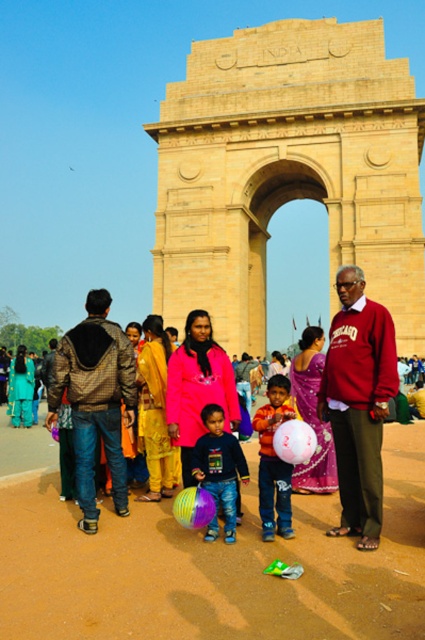
Question: Can you confirm if brown textured jacket at center is smaller than matte pink dress at center?

Choices:
 (A) no
 (B) yes

Answer: (B)

Question: Which object is the farthest from the multicolored plastic ball at center?

Choices:
 (A) brown textured jacket at center
 (B) translucent multicolored balloon at center
 (C) matte pink balloon at center
 (D) white glossy balloon at center

Answer: (A)

Question: Where is matte pink dress at center located in relation to translucent multicolored balloon at center in the image?

Choices:
 (A) above
 (B) below

Answer: (A)

Question: Can you confirm if maroon sweater at center is smaller than white glossy balloon at center?

Choices:
 (A) yes
 (B) no

Answer: (B)

Question: Which point appears closest to the camera in this image?

Choices:
 (A) (237, 499)
 (B) (195, 500)
 (C) (28, 440)

Answer: (B)

Question: Which of these objects is positioned closest to the maroon sweater at center?

Choices:
 (A) white glossy balloon at center
 (B) brown textured jacket at center

Answer: (A)